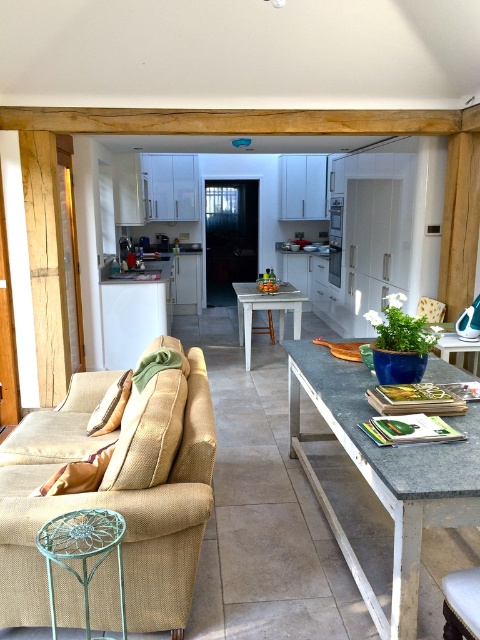
Question: Is granite white table at center smaller than granite table at center?

Choices:
 (A) yes
 (B) no

Answer: (B)

Question: Does granite white table at center appear under white painted wood table at center?

Choices:
 (A) no
 (B) yes

Answer: (B)

Question: Based on their relative distances, which object is nearer to the beige fabric couch at left?

Choices:
 (A) granite table at center
 (B) granite white table at center
 (C) white painted wood table at center
 (D) beige fabric armchair at center

Answer: (B)

Question: Can you confirm if beige fabric couch at left is positioned below white painted wood table at center?

Choices:
 (A) no
 (B) yes

Answer: (B)

Question: Which point appears farthest from the camera in this image?

Choices:
 (A) (451, 342)
 (B) (440, 307)
 (C) (160, 388)

Answer: (B)

Question: Which of these objects is positioned closest to the beige fabric armchair at center?

Choices:
 (A) granite white table at center
 (B) granite table at center
 (C) beige fabric couch at left
 (D) white painted wood table at center

Answer: (B)